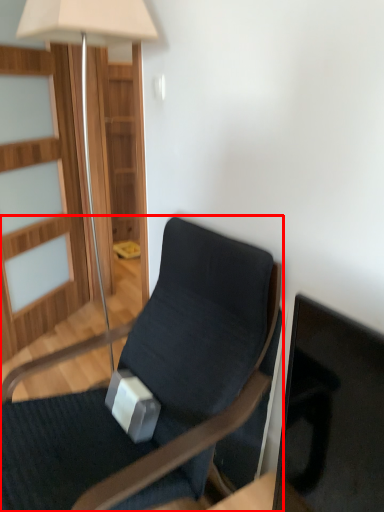
Question: Observing the image, what is the correct spatial positioning of chair (annotated by the red box) in reference to lamp?

Choices:
 (A) left
 (B) right

Answer: (B)